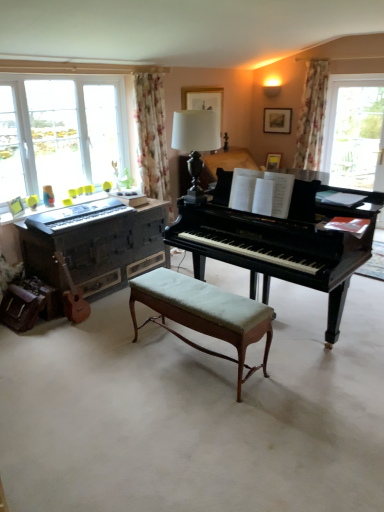
Identify the location of vacant area on top of light green upholstered bench at center (from a real-world perspective). This screenshot has height=512, width=384. (203, 297).